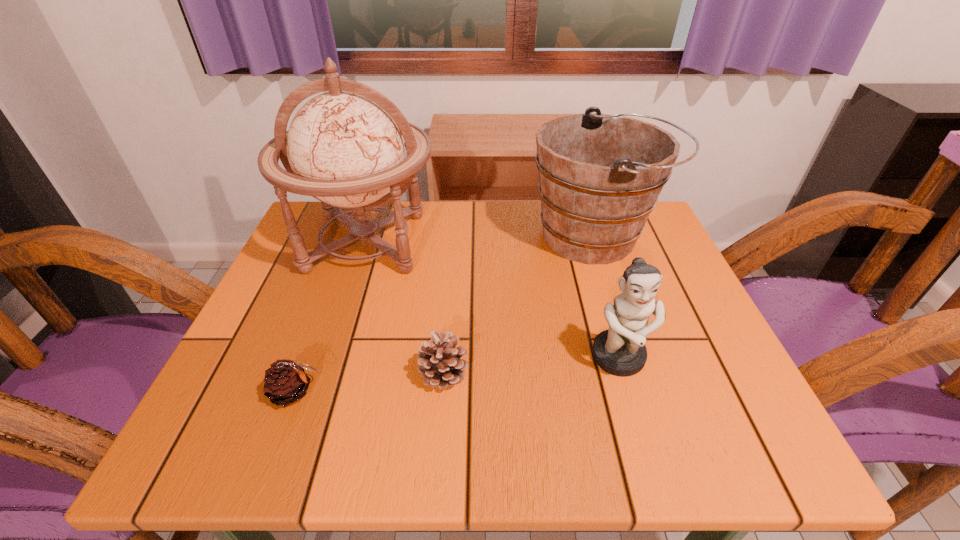
This screenshot has height=540, width=960. Identify the location of object that is at the far right corner. (600, 175).

The image size is (960, 540). I want to click on free space at the far edge, so click(477, 254).

Identify the location of vacant region at the near edge. This screenshot has width=960, height=540. coord(634,429).

Locate an element on the screen. The height and width of the screenshot is (540, 960). vacant space at the left edge is located at coordinates (267, 313).

Identify the location of vacant position at the right edge of the desktop. This screenshot has height=540, width=960. (727, 364).

In the image, there is a desktop. Identify the location of vacant space at the far left corner. The width and height of the screenshot is (960, 540). (331, 233).

Where is `vacant space at the far right corner of the desktop`? The height and width of the screenshot is (540, 960). vacant space at the far right corner of the desktop is located at coordinates (668, 247).

I want to click on vacant area that lies between the fourth shortest object and the taller pinecone, so click(x=519, y=305).

Locate an element on the screen. unoccupied position between the second tallest object and the tallest object is located at coordinates (481, 240).

The image size is (960, 540). I want to click on vacant point located between the shortest object and the right pinecone, so click(370, 382).